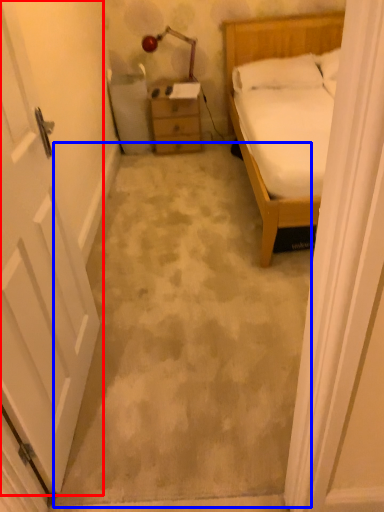
Question: Which point is closer to the camera, door (highlighted by a red box) or concrete (highlighted by a blue box)?

Choices:
 (A) door
 (B) concrete

Answer: (A)